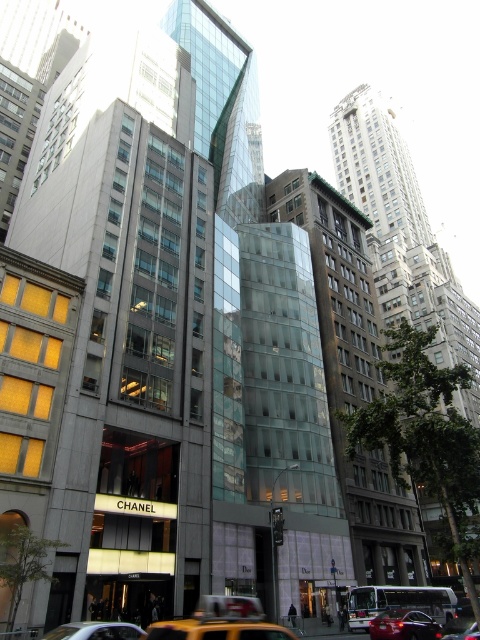
You are a delivery person standing at the entrance of the Chanel store. You need to place a package on the yellow rubber taxi at lower center. According to the coordinates provided, what is the shortest path you can take to reach the taxi without crossing any obstacles?

The yellow rubber taxi at lower center is located at coordinates point (220,621). Since there are no obstacles mentioned in the scene description, the shortest path would be a straight line from the entrance of the Chanel store to the taxi at those coordinates.

You are a delivery person needing to reach the Chanel store entrance marked by large glass doors. You are currently standing near the yellow matte taxi cab at center. Based on the scene description, can you determine the direction you should walk to reach the store entrance?

The yellow matte taxi cab at center is located at point [96,630]. Since the Chanel store is at the ground level of the building with its entrance marked by large glass doors, you should walk towards the building from the taxi cab to reach the entrance.